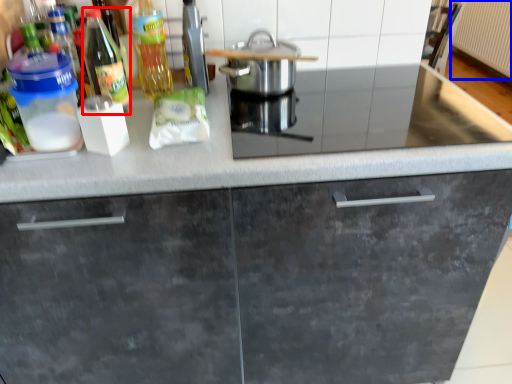
Question: Among these objects, which one is nearest to the camera, bottle (highlighted by a red box) or radiator (highlighted by a blue box)?

Choices:
 (A) bottle
 (B) radiator

Answer: (A)